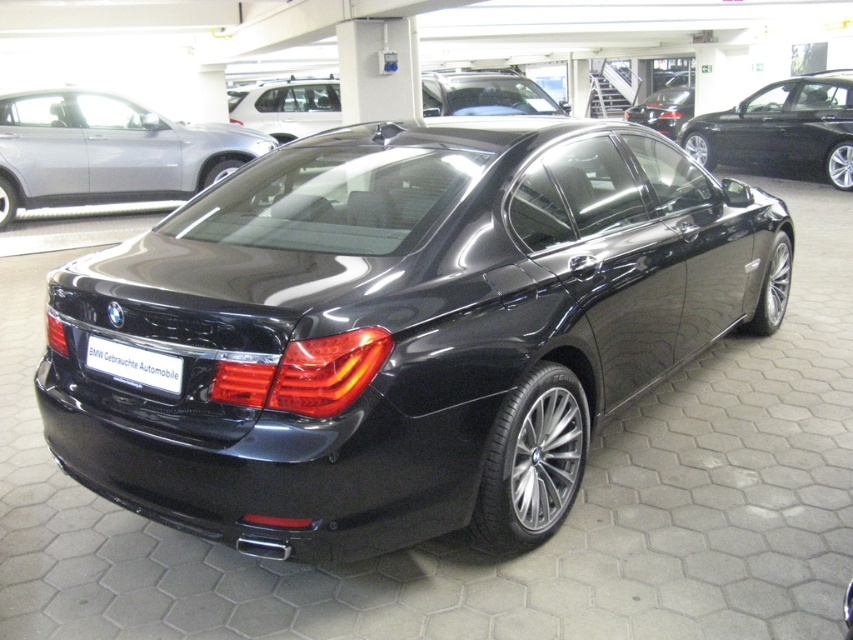
You are a parking attendant who needs to fit a new car into the available space between the two glossy black sedans. The new car is 4.5 meters long. Can you determine if there is enough space between the glossy black sedan at upper left and the glossy black sedan at upper right to accommodate the new car?

The glossy black sedan at upper left is shorter than the glossy black sedan at upper right, but the exact distance between them is not provided. Without knowing the actual space between the two sedans, it is impossible to determine if the new car will fit.

You are a parking attendant who needs to fit both the glossy black sedan at upper left and the glossy black sedan at center into a parking spot that is 1.6 meters in height. Which sedan will not fit into the parking spot?

The glossy black sedan at upper left is much taller than the glossy black sedan at center, so the glossy black sedan at upper left will not fit into the parking spot that is 1.6 meters in height.